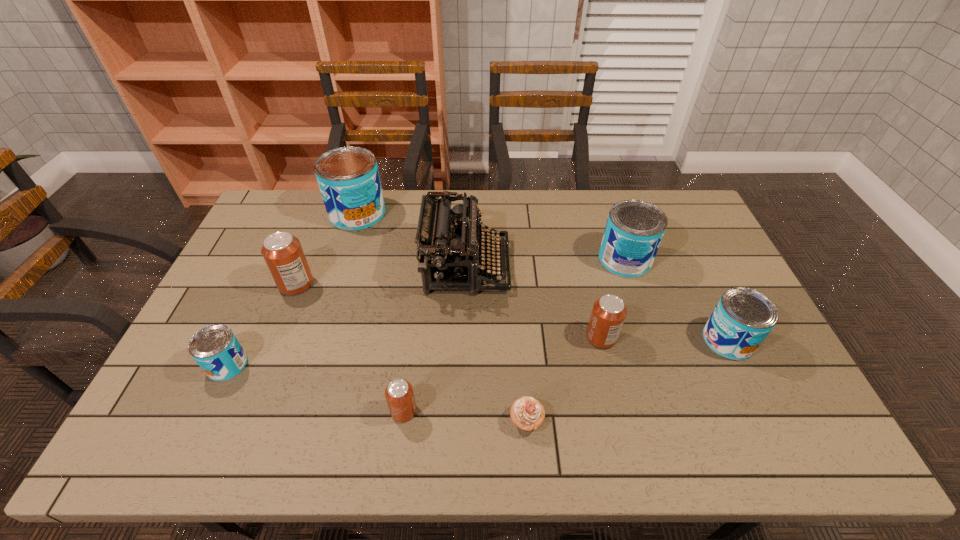
Identify the location of the rightmost object. (743, 318).

At what (x,y) coordinates should I click in order to perform the action: click on the smallest blue can. Please return your answer as a coordinate pair (x, y). This screenshot has width=960, height=540. Looking at the image, I should click on (215, 348).

This screenshot has width=960, height=540. Identify the location of the second orange can from right to left. (399, 394).

Where is `the fourth can from right to left`? The image size is (960, 540). the fourth can from right to left is located at coordinates (399, 394).

Identify the location of cupcake. The height and width of the screenshot is (540, 960). (527, 413).

You are a GUI agent. You are given a task and a screenshot of the screen. Output one action in this format:
    pyautogui.click(x=<x>, y=<y>)
    Task: Click on the blank area located on the left of the farthest blue can
    
    Given the screenshot: What is the action you would take?
    pyautogui.click(x=272, y=214)

The image size is (960, 540). In order to click on free location located on the typing side of the typewriter in this screenshot , I will do `click(630, 266)`.

The width and height of the screenshot is (960, 540). Find the location of `vacant space situated 0.300m on the back of the second can from right to left`. vacant space situated 0.300m on the back of the second can from right to left is located at coordinates (602, 191).

Where is `free region located on the right of the farthest orange can`? Image resolution: width=960 pixels, height=540 pixels. free region located on the right of the farthest orange can is located at coordinates (372, 284).

At what (x,y) coordinates should I click in order to perform the action: click on vacant space situated 0.160m on the back of the seventh object from left to right. Please return your answer as a coordinate pair (x, y). Looking at the image, I should click on (588, 284).